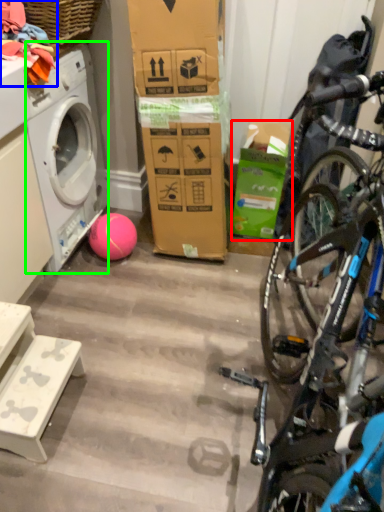
Question: Which object is positioned closest to box (highlighted by a red box)? Select from clothing (highlighted by a blue box) and washing machine (highlighted by a green box).

Choices:
 (A) clothing
 (B) washing machine

Answer: (B)